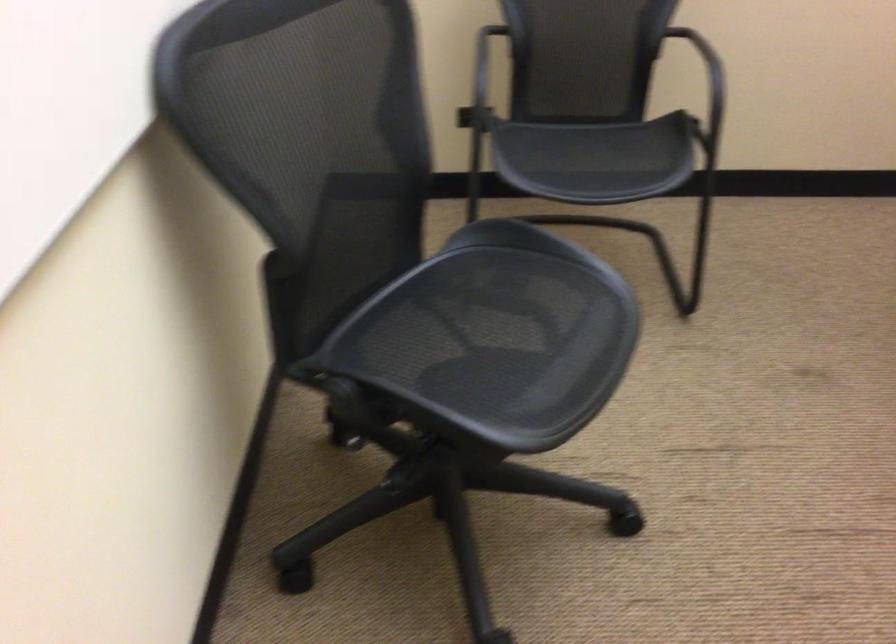
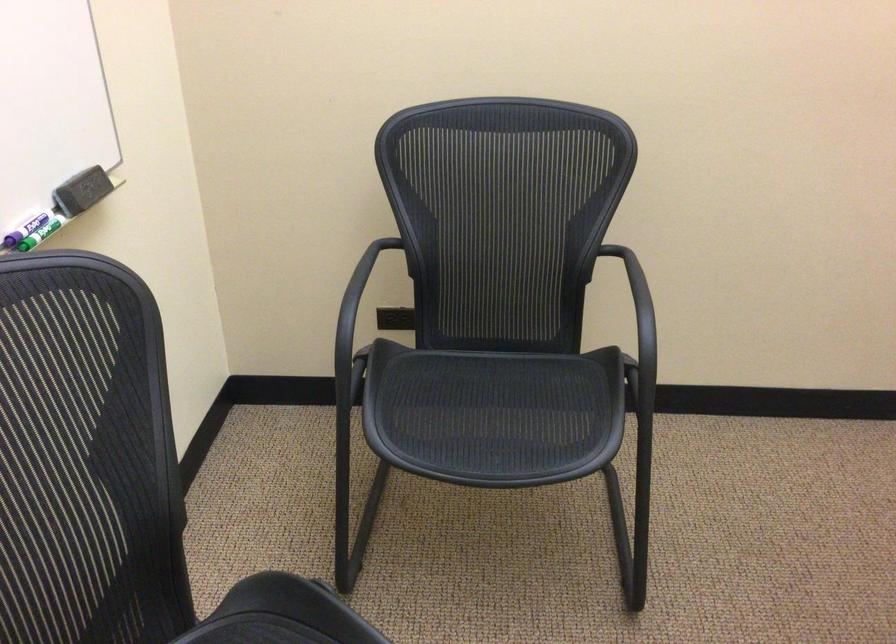
In the second image, find the point that corresponds to the point at 714,90 in the first image.

(639, 348)